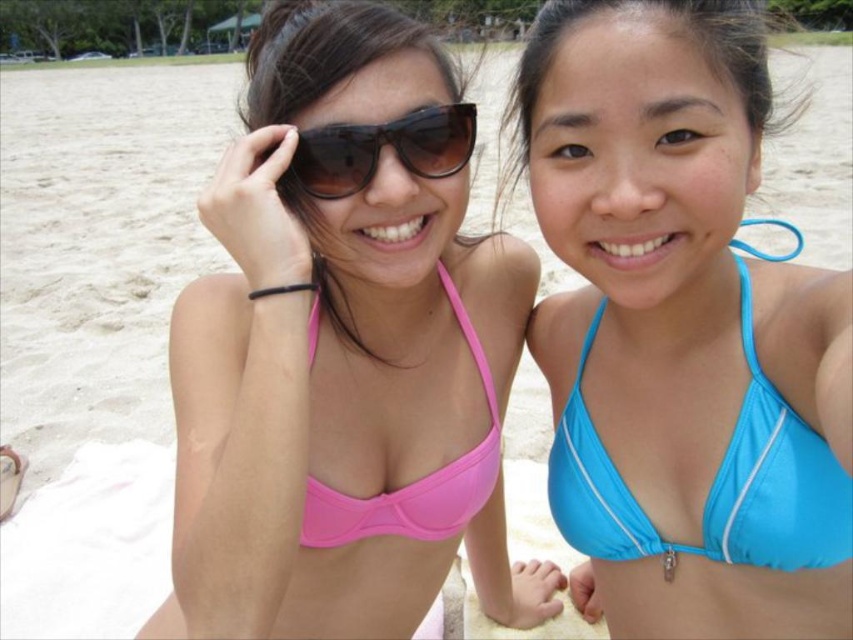
You are a photographer trying to capture a clear shot of both the blue shiny bikini top at center and the pink matte bikini top at center. Which one is closer to the camera?

The blue shiny bikini top at center is closer to the camera because it is in front of the pink matte bikini top at center.

You are a fashion designer observing the two bikinis in the image. Which bikini top has a wider design between the blue shiny bikini top at center and the pink matte bikini top at center?

The blue shiny bikini top at center has a larger width than the pink matte bikini top at center, so it has a wider design.

Looking at this image, you are a photographer setting up for a beach photoshoot. You need to ensure that the blue shiny bikini top at center and the pink matte bikini top at center are exactly 40 centimeters apart for the composition. Based on the current setup, do you need to adjust their positions?

The blue shiny bikini top at center and the pink matte bikini top at center are currently 37.20 centimeters apart. Since the desired distance is 40 centimeters, you need to move them slightly apart to increase the distance between them by approximately 2.8 centimeters.